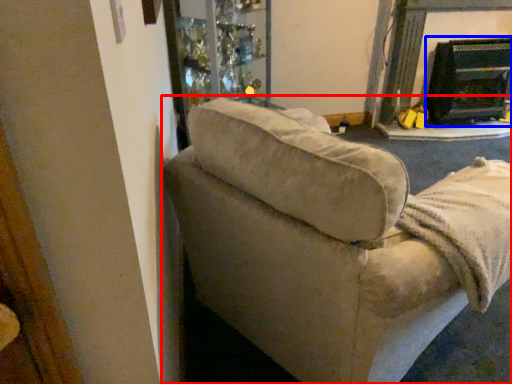
Question: Which of the following is the farthest to the observer, studio couch (highlighted by a red box) or fireplace (highlighted by a blue box)?

Choices:
 (A) studio couch
 (B) fireplace

Answer: (B)